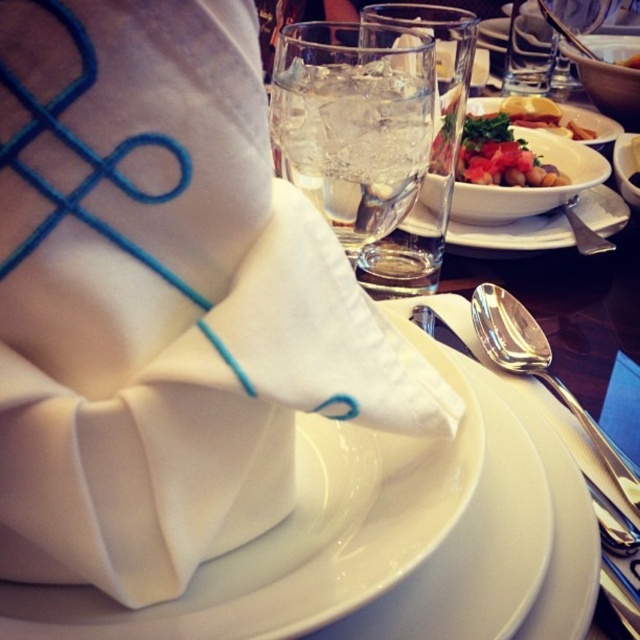
You are a server arranging a table. You have a tomato salad with chickpeas at center and a white porcelain plate at center. Which item should you place first to ensure proper fitting?

The tomato salad with chickpeas at center should be placed first because the white porcelain plate at center is larger in width and can accommodate the salad afterward.

You are a guest at the table and want to reach for the item located at point [140,621] and the item at point [545,186]. Which item will you need to move first to access the one behind it?

You need to move the item at point [140,621] first because it is in front of the item at point [545,186].

You are holding a 5.5 inch wide ruler. If you want to measure the distance from your current position to the point at coordinates point (x=376, y=592), can you cover the entire distance with your ruler?

The distance between point (x=376, y=592) and the viewer is 6.00 inches. Since the ruler is only 5.5 inches wide, it cannot cover the entire distance.